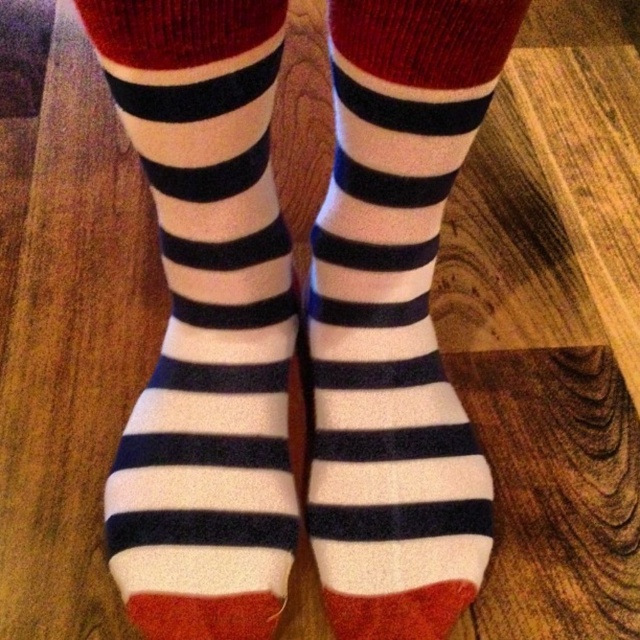
Is white woolen socks at center shorter than white/soft cotton socks at center?

Incorrect, white woolen socks at center's height does not fall short of white/soft cotton socks at center's.

Can you confirm if white woolen socks at center is taller than white/soft cotton socks at center?

Indeed, white woolen socks at center has a greater height compared to white/soft cotton socks at center.

Locate an element on the screen. Image resolution: width=640 pixels, height=640 pixels. white woolen socks at center is located at coordinates (205, 321).

Does point (156, 154) come in front of point (406, 173)?

Yes.

The height and width of the screenshot is (640, 640). Describe the element at coordinates (205, 321) in the screenshot. I see `white woolen socks at center` at that location.

The height and width of the screenshot is (640, 640). What do you see at coordinates (205, 321) in the screenshot?
I see `white woolen socks at center` at bounding box center [205, 321].

At what (x,y) coordinates should I click in order to perform the action: click on white woolen socks at center. Please return your answer as a coordinate pair (x, y). Image resolution: width=640 pixels, height=640 pixels. Looking at the image, I should click on (205, 321).

Who is taller, white/soft cotton socks at center or white soft socks at center?

With more height is white soft socks at center.

Which is more to the right, white/soft cotton socks at center or white soft socks at center?

From the viewer's perspective, white soft socks at center appears more on the right side.

Between point (124, 545) and point (424, 209), which one is positioned behind?

Positioned behind is point (124, 545).

The height and width of the screenshot is (640, 640). What are the coordinates of `white/soft cotton socks at center` in the screenshot? It's located at (205, 321).